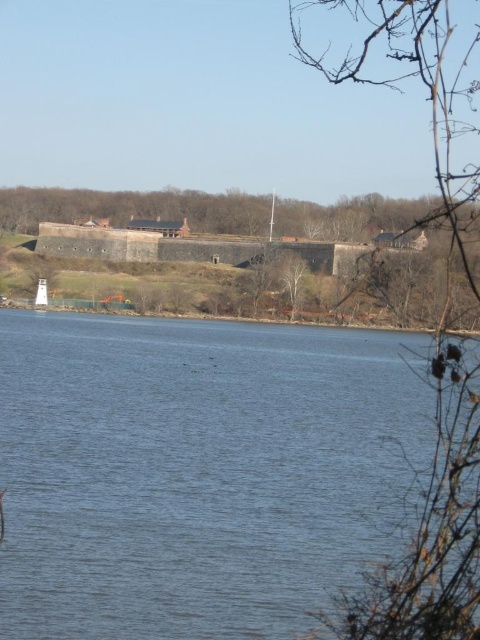
Question: Does blue water at center have a smaller size compared to bare branches at center?

Choices:
 (A) no
 (B) yes

Answer: (A)

Question: Which object is positioned closest to the brown wooden tree at center?

Choices:
 (A) bare branches at right
 (B) blue water at center

Answer: (A)

Question: Observing the image, what is the correct spatial positioning of brown wooden tree at center in reference to bare branches at center?

Choices:
 (A) below
 (B) above

Answer: (B)

Question: Is blue water at center in front of bare branches at right?

Choices:
 (A) yes
 (B) no

Answer: (B)

Question: Considering the real-world distances, which object is closest to the bare branches at center?

Choices:
 (A) bare branches at right
 (B) brown wooden tree at center

Answer: (A)

Question: Based on their relative distances, which object is nearer to the brown wooden tree at center?

Choices:
 (A) blue water at center
 (B) bare branches at center

Answer: (B)